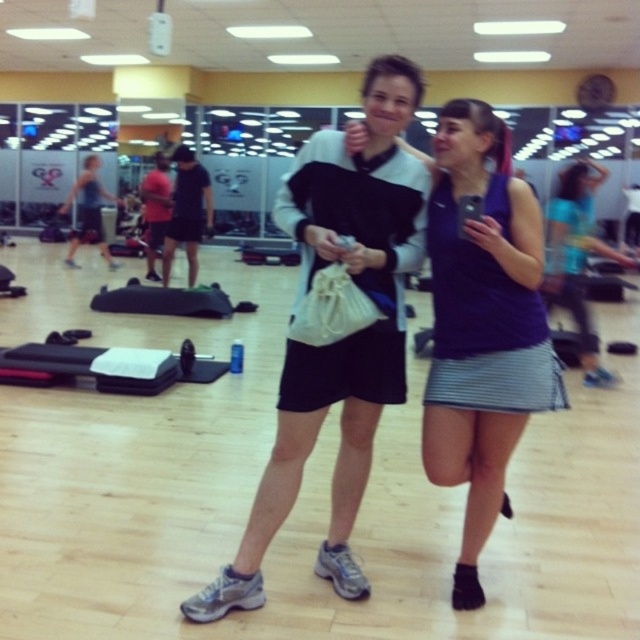
You are a fitness instructor preparing to lead a group exercise class. You need to ensure there is enough space between participants to move safely. The recommended minimum distance between participants is 2 meters. Based on the image, can the participants wearing the white matte jacket at center and the purple fabric tank top at center maintain the required social distancing?

The distance between the white matte jacket at center and the purple fabric tank top at center is 3.15 meters, which exceeds the recommended minimum of 2 meters. Therefore, they can maintain the required social distancing.

You are organizing a clothing rack in a store and need to place the white matte jacket at center and the purple fabric tank top at center next to each other. Which item will require more space on the rack?

The purple fabric tank top at center requires more space on the rack because it occupies more space than the white matte jacket at center.